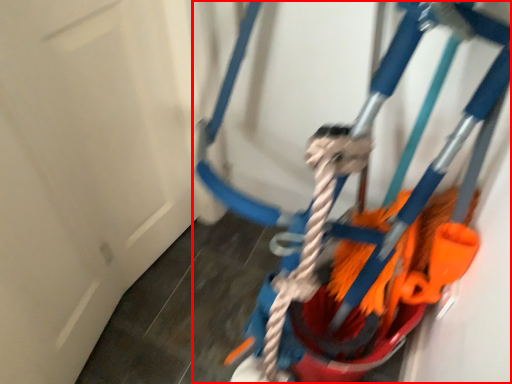
Question: From the image's perspective, what is the correct spatial relationship of toy (annotated by the red box) in relation to door?

Choices:
 (A) below
 (B) above

Answer: (B)